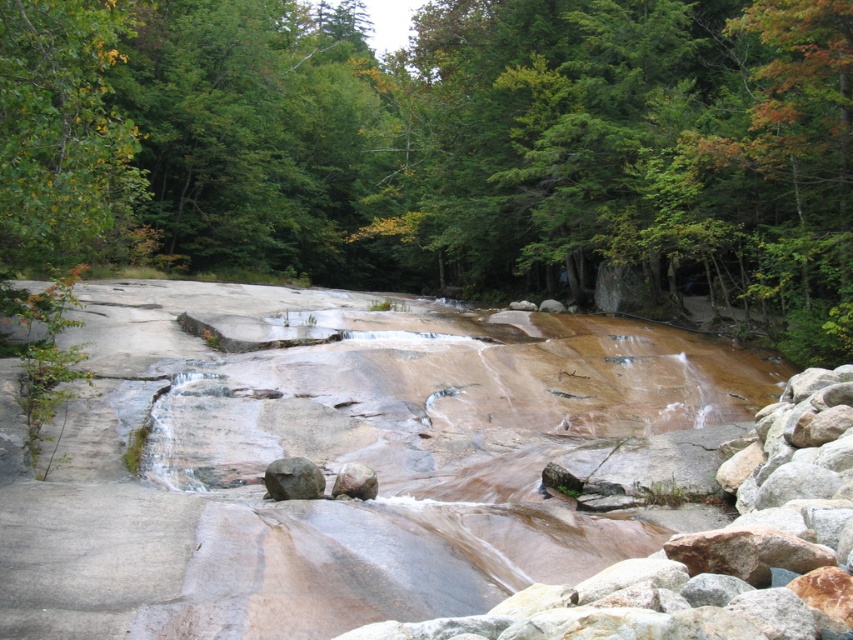
Question: Which object is farther from the camera taking this photo?

Choices:
 (A) smooth brown rock at center
 (B) rusty metallic rock at center
 (C) green leafy tree at upper left
 (D) smooth gray rock at center

Answer: (D)

Question: Does green leafy tree at upper left appear under smooth gray rock at center?

Choices:
 (A) no
 (B) yes

Answer: (A)

Question: Which of the following is the farthest from the observer?

Choices:
 (A) (28, 179)
 (B) (772, 596)

Answer: (A)

Question: Is the position of green leafy tree at upper left less distant than that of rusty metallic rock at center?

Choices:
 (A) no
 (B) yes

Answer: (A)

Question: Can you confirm if smooth brown rock at center is wider than green leafy tree at upper left?

Choices:
 (A) no
 (B) yes

Answer: (A)

Question: Which object is farther from the camera taking this photo?

Choices:
 (A) green leafy tree at upper left
 (B) smooth gray rock at center
 (C) smooth brown rock at center
 (D) rusty metallic rock at center

Answer: (B)